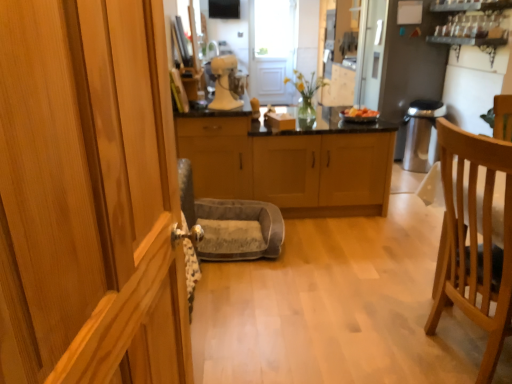
Question: Would you consider light wood cabinetry at center, arranged as the first cabinetry when viewed from the right, to be distant from light brown wood cabinet at center, the 2th cabinetry viewed from the right?

Choices:
 (A) no
 (B) yes

Answer: (B)

Question: Could you tell me if light wood cabinetry at center, the 3th cabinetry in the left-to-right sequence, is facing light brown wood cabinet at center, which is counted as the 2th cabinetry, starting from the left?

Choices:
 (A) no
 (B) yes

Answer: (A)

Question: From the image's perspective, does light wood cabinetry at center, which is the 3th cabinetry in front-to-back order, appear higher than light brown wood cabinet at center, which is the third cabinetry in back-to-front order?

Choices:
 (A) no
 (B) yes

Answer: (B)

Question: Considering the relative positions of light wood cabinetry at center, arranged as the first cabinetry when viewed from the right, and light brown wood cabinet at center, the 2th cabinetry viewed from the right, in the image provided, is light wood cabinetry at center, arranged as the first cabinetry when viewed from the right, behind light brown wood cabinet at center, the 2th cabinetry viewed from the right,?

Choices:
 (A) no
 (B) yes

Answer: (B)

Question: Is light wood cabinetry at center, which is the 3th cabinetry in front-to-back order, taller than light brown wood cabinet at center, which appears as the 1th cabinetry when viewed from the front?

Choices:
 (A) yes
 (B) no

Answer: (B)

Question: From the image's perspective, would you say light wood cabinetry at center, which ranks as the 1th cabinetry in back-to-front order, is shown under light brown wood cabinet at center, which is the third cabinetry in back-to-front order?

Choices:
 (A) yes
 (B) no

Answer: (B)

Question: From the image's perspective, is satin silver refrigerator at upper right over smooth plastic bowl at center?

Choices:
 (A) yes
 (B) no

Answer: (A)

Question: Does satin silver refrigerator at upper right have a greater width compared to smooth plastic bowl at center?

Choices:
 (A) yes
 (B) no

Answer: (A)

Question: Can you confirm if satin silver refrigerator at upper right is smaller than smooth plastic bowl at center?

Choices:
 (A) yes
 (B) no

Answer: (B)

Question: Is satin silver refrigerator at upper right positioned with its back to smooth plastic bowl at center?

Choices:
 (A) no
 (B) yes

Answer: (A)

Question: From the image's perspective, is satin silver refrigerator at upper right below smooth plastic bowl at center?

Choices:
 (A) yes
 (B) no

Answer: (B)

Question: Is satin silver refrigerator at upper right next to smooth plastic bowl at center and touching it?

Choices:
 (A) no
 (B) yes

Answer: (A)

Question: Is light wood cabinetry at center, arranged as the first cabinetry when viewed from the right, to the left of smooth plastic bowl at center from the viewer's perspective?

Choices:
 (A) no
 (B) yes

Answer: (B)